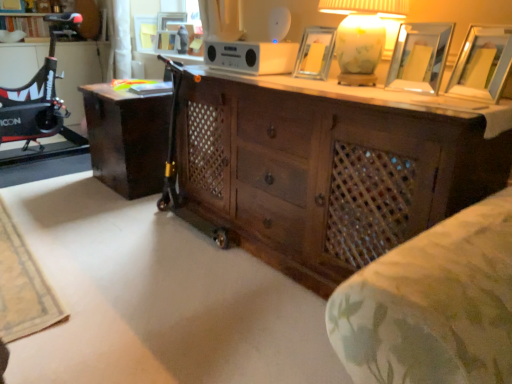
Question: From a real-world perspective, does dark wood desk at center sit lower than metallic silver picture frame at upper right, acting as the fourth picture frame starting from the back?

Choices:
 (A) yes
 (B) no

Answer: (A)

Question: From a real-world perspective, is dark wood desk at center on metallic silver picture frame at upper right, the 4th picture frame viewed from the left?

Choices:
 (A) no
 (B) yes

Answer: (A)

Question: Are dark wood desk at center and metallic silver picture frame at upper right, arranged as the second picture frame when viewed from the right, far apart?

Choices:
 (A) no
 (B) yes

Answer: (B)

Question: Is dark wood desk at center smaller than metallic silver picture frame at upper right, which ranks as the 4th picture frame in top-to-bottom order?

Choices:
 (A) no
 (B) yes

Answer: (A)

Question: From the image's perspective, is dark wood desk at center on top of metallic silver picture frame at upper right, which is counted as the second picture frame, starting from the bottom?

Choices:
 (A) no
 (B) yes

Answer: (A)

Question: Is dark wood desk at center surrounding metallic silver picture frame at upper right, the 4th picture frame viewed from the left?

Choices:
 (A) yes
 (B) no

Answer: (B)

Question: Considering the relative sizes of wooden picture frame at upper center, the 4th picture frame in the front-to-back sequence, and dark wood desk at center in the image provided, is wooden picture frame at upper center, the 4th picture frame in the front-to-back sequence, smaller than dark wood desk at center?

Choices:
 (A) yes
 (B) no

Answer: (A)

Question: From the image's perspective, is wooden picture frame at upper center, which is the 4th picture frame in bottom-to-top order, under dark wood desk at center?

Choices:
 (A) yes
 (B) no

Answer: (B)

Question: Does wooden picture frame at upper center, which is counted as the second picture frame, starting from the left, have a lesser height compared to dark wood desk at center?

Choices:
 (A) yes
 (B) no

Answer: (A)

Question: Is wooden picture frame at upper center, which ranks as the second picture frame in top-to-bottom order, thinner than dark wood desk at center?

Choices:
 (A) no
 (B) yes

Answer: (B)

Question: Is there a large distance between wooden picture frame at upper center, which is counted as the second picture frame, starting from the left, and dark wood desk at center?

Choices:
 (A) no
 (B) yes

Answer: (B)

Question: Does wooden picture frame at upper center, which is counted as the second picture frame, starting from the left, have a larger size compared to dark wood desk at center?

Choices:
 (A) no
 (B) yes

Answer: (A)

Question: Can you confirm if dark wood desk at center is shorter than wooden picture frame at upper right, which is the 1th picture frame from front to back?

Choices:
 (A) yes
 (B) no

Answer: (B)